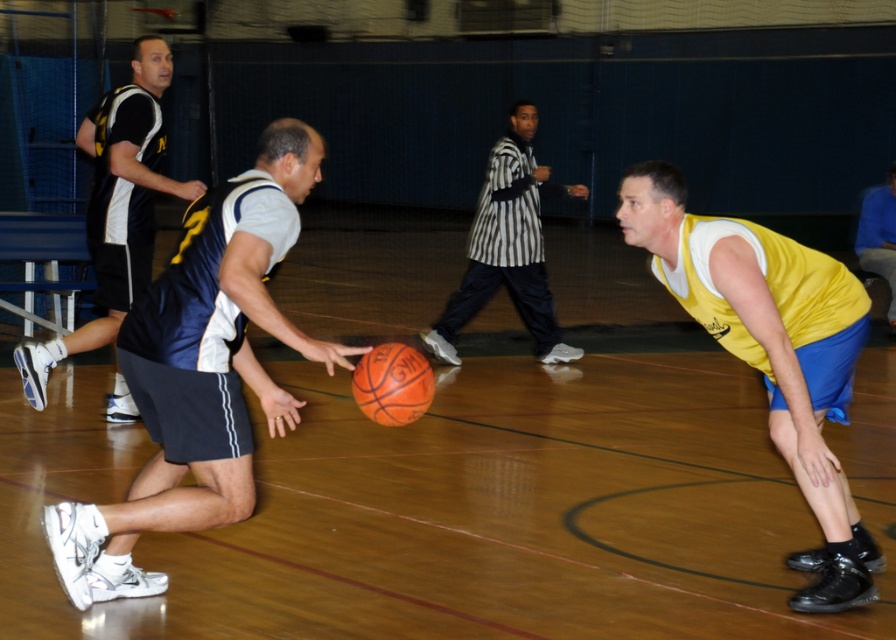
Question: In this image, where is yellow matte jersey at center located relative to black jersey at left?

Choices:
 (A) left
 (B) right

Answer: (B)

Question: Which object is farther from the camera taking this photo?

Choices:
 (A) yellow jersey at right
 (B) yellow matte jersey at center
 (C) orange rubber basketball at center
 (D) blue jersey at center

Answer: (A)

Question: Which of the following is the farthest from the observer?

Choices:
 (A) yellow jersey at right
 (B) blue jersey at center
 (C) striped referee shirt at center
 (D) yellow matte jersey at center

Answer: (A)

Question: Which of the following is the closest to the observer?

Choices:
 (A) yellow jersey at right
 (B) orange rubber basketball at center

Answer: (B)

Question: Is yellow matte jersey at center smaller than orange rubber basketball at center?

Choices:
 (A) no
 (B) yes

Answer: (A)

Question: Is black jersey at left below orange rubber basketball at center?

Choices:
 (A) no
 (B) yes

Answer: (A)